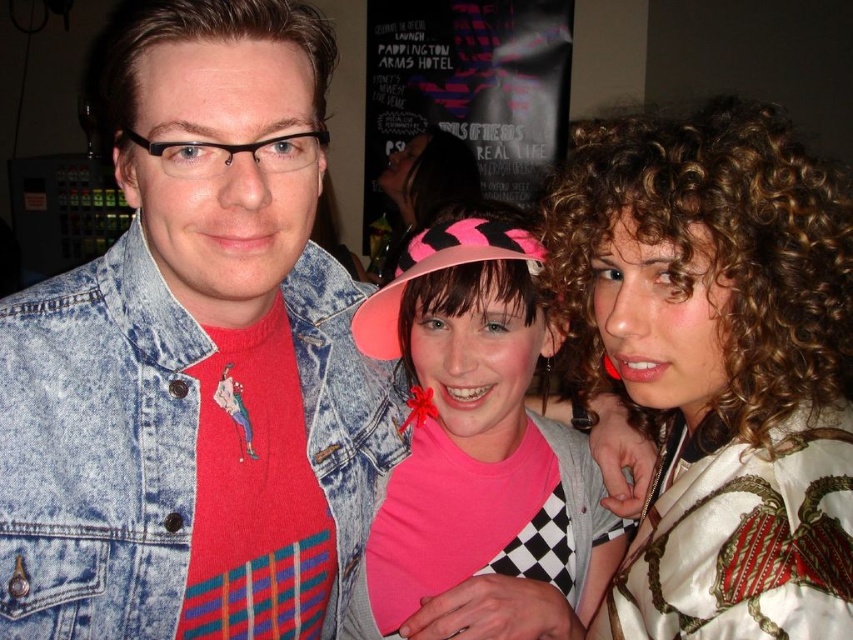
Find the location of a particular element. The height and width of the screenshot is (640, 853). white satin blouse at center is located at coordinates (717, 365).

Consider the image. Is white satin blouse at center closer to the viewer compared to faded denim jacket at upper left?

Yes, white satin blouse at center is closer to the viewer.

This screenshot has height=640, width=853. In order to click on white satin blouse at center in this screenshot , I will do [717, 365].

Who is positioned more to the left, white satin blouse at center or silky white robe with red and gold patterns at right?

silky white robe with red and gold patterns at right

From the picture: Between white satin blouse at center and silky white robe with red and gold patterns at right, which one is positioned higher?

Positioned higher is white satin blouse at center.

Between point (685, 529) and point (809, 600), which one is positioned behind?

Point (685, 529)

Locate an element on the screen. This screenshot has width=853, height=640. white satin blouse at center is located at coordinates (717, 365).

Is faded denim jacket at upper left shorter than pink matte hat at center?

Correct, faded denim jacket at upper left is not as tall as pink matte hat at center.

Describe the element at coordinates (97, 451) in the screenshot. The image size is (853, 640). I see `faded denim jacket at upper left` at that location.

The width and height of the screenshot is (853, 640). Identify the location of faded denim jacket at upper left. click(97, 451).